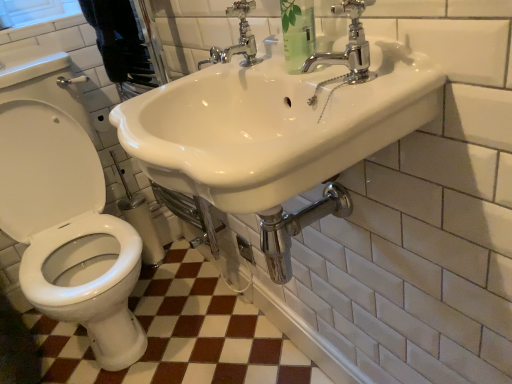
Question: Is chrome/metallic faucet at upper center, arranged as the first tap when viewed from the left, in front of or behind chrome/metallic faucet at upper right, which ranks as the 1th tap in right-to-left order, in the image?

Choices:
 (A) front
 (B) behind

Answer: (B)

Question: From a real-world perspective, is chrome/metallic faucet at upper center, positioned as the second tap in front-to-back order, above or below chrome/metallic faucet at upper right, acting as the first tap starting from the front?

Choices:
 (A) below
 (B) above

Answer: (B)

Question: Which object is the farthest from the chrome/metallic faucet at upper right, which is the 2th tap from left to right?

Choices:
 (A) chrome/metallic faucet at upper center, arranged as the first tap when viewed from the left
 (B) white glossy ceramic tile at lower left
 (C) white glossy toilet at left
 (D) white glossy sink at upper center
 (E) clear plastic bottle at upper center

Answer: (B)

Question: Considering the real-world distances, which object is closest to the white glossy ceramic tile at lower left?

Choices:
 (A) chrome/metallic faucet at upper right, which is the 2th tap from left to right
 (B) white glossy sink at upper center
 (C) white glossy toilet at left
 (D) clear plastic bottle at upper center
 (E) chrome/metallic faucet at upper center, positioned as the second tap in front-to-back order

Answer: (C)